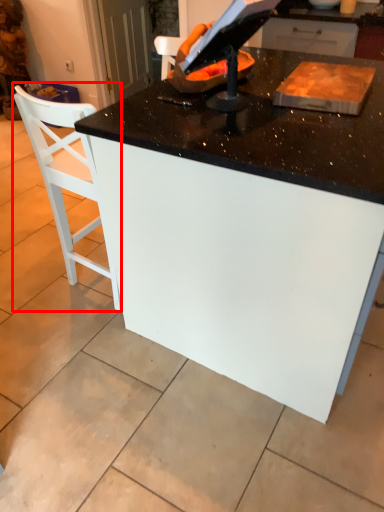
Question: Where is chair (annotated by the red box) located in relation to table in the image?

Choices:
 (A) left
 (B) right

Answer: (A)